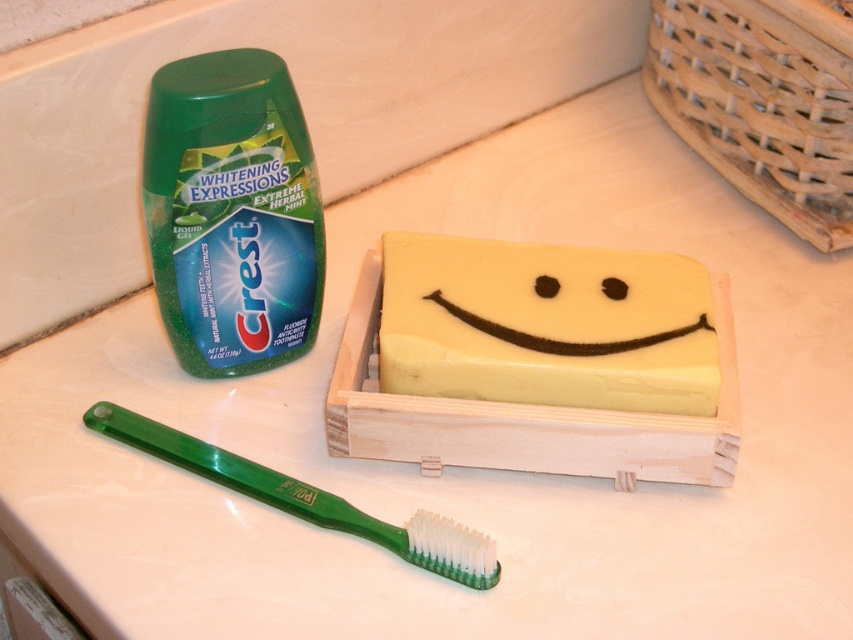
How far apart are green glossy toothpaste tube at upper left and green plastic toothbrush at lower left?

green glossy toothpaste tube at upper left and green plastic toothbrush at lower left are 10.15 inches apart from each other.

Does green glossy toothpaste tube at upper left have a lesser width compared to green plastic toothbrush at lower left?

Correct, green glossy toothpaste tube at upper left's width is less than green plastic toothbrush at lower left's.

At what (x,y) coordinates should I click in order to perform the action: click on green glossy toothpaste tube at upper left. Please return your answer as a coordinate pair (x, y). Looking at the image, I should click on (231, 212).

Can you confirm if yellow translucent soap at center is positioned below green plastic toothbrush at lower left?

Incorrect, yellow translucent soap at center is not positioned below green plastic toothbrush at lower left.

Describe the element at coordinates (546, 324) in the screenshot. This screenshot has height=640, width=853. I see `yellow translucent soap at center` at that location.

Locate an element on the screen. yellow translucent soap at center is located at coordinates (546, 324).

Between yellow translucent soap at center and green glossy toothpaste tube at upper left, which one is positioned lower?

Positioned lower is yellow translucent soap at center.

Consider the image. Can you confirm if yellow translucent soap at center is positioned to the left of green glossy toothpaste tube at upper left?

No, yellow translucent soap at center is not to the left of green glossy toothpaste tube at upper left.

Who is more forward, (474, 292) or (190, 93)?

Point (190, 93) is in front.

You are a GUI agent. You are given a task and a screenshot of the screen. Output one action in this format:
    pyautogui.click(x=<x>, y=<y>)
    Task: Click on the yellow translucent soap at center
    
    Given the screenshot: What is the action you would take?
    pyautogui.click(x=546, y=324)